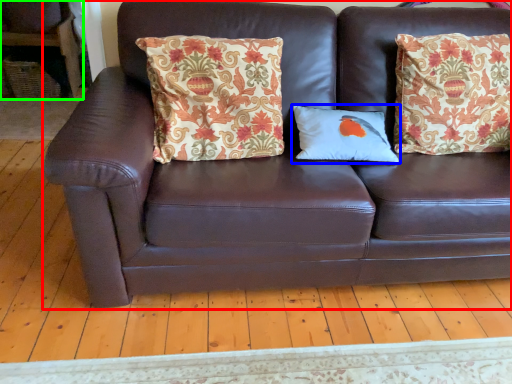
Question: Based on their relative distances, which object is farther from studio couch (highlighted by a red box)? Choose from pillow (highlighted by a blue box) and armchair (highlighted by a green box).

Choices:
 (A) pillow
 (B) armchair

Answer: (B)